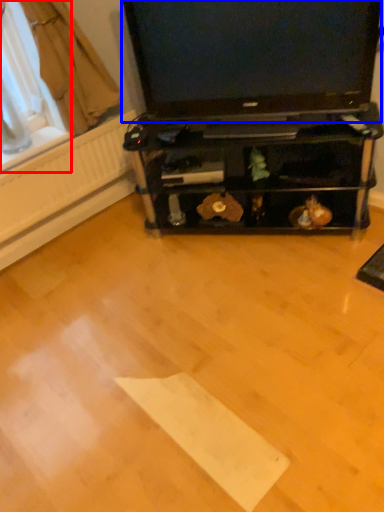
Question: Which point is further to the camera, window screen (highlighted by a red box) or television (highlighted by a blue box)?

Choices:
 (A) window screen
 (B) television

Answer: (A)